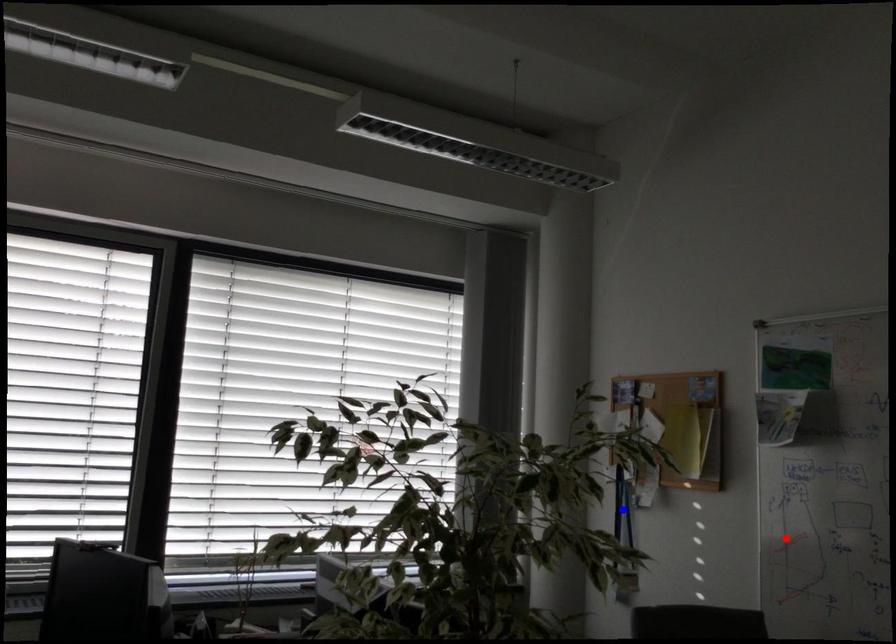
Question: In the image, two points are highlighted. Which point is nearer to the camera? Reply with the corresponding letter.

Choices:
 (A) blue point
 (B) red point

Answer: (B)